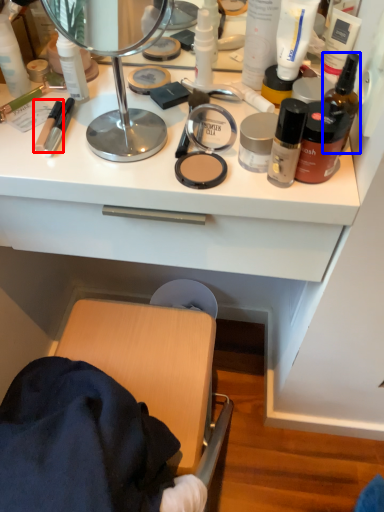
Question: Which object appears farthest to the camera in this image, toiletry (highlighted by a red box) or toiletry (highlighted by a blue box)?

Choices:
 (A) toiletry
 (B) toiletry

Answer: (A)